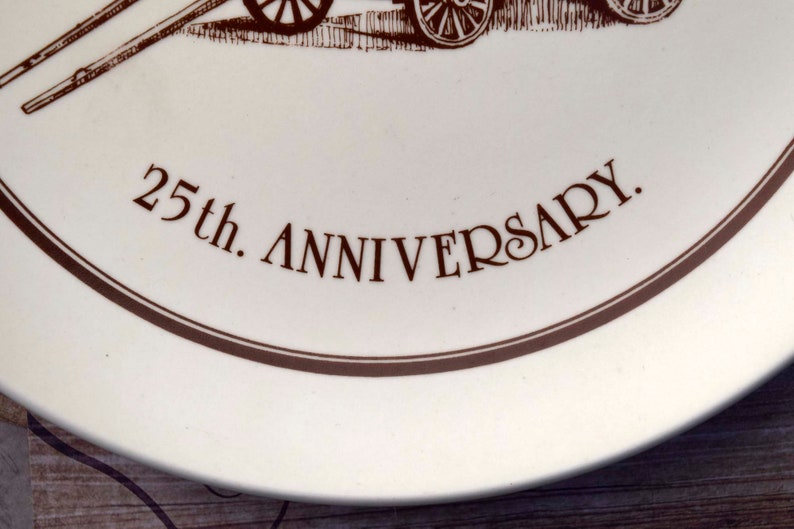
In order to click on wooden surface in this screenshot , I will do `click(692, 472)`.